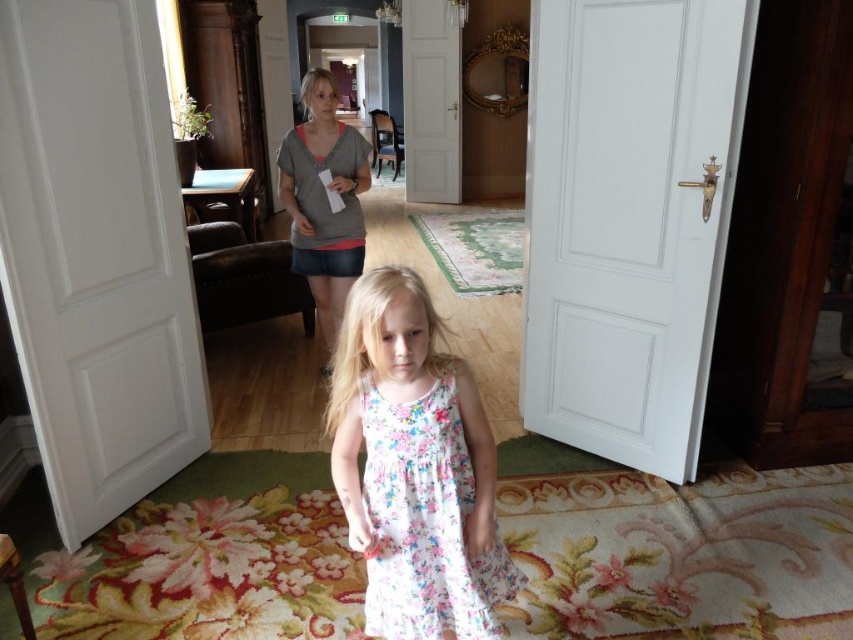
Does point (497, 600) lie behind point (323, 209)?

No, it is in front of (323, 209).

Between floral cotton dress at center and gray cotton shirt at upper center, which one has less height?

floral cotton dress at center

Does point (454, 477) come in front of point (305, 276)?

Yes, point (454, 477) is closer to viewer.

Locate an element on the screen. The width and height of the screenshot is (853, 640). floral cotton dress at center is located at coordinates (415, 468).